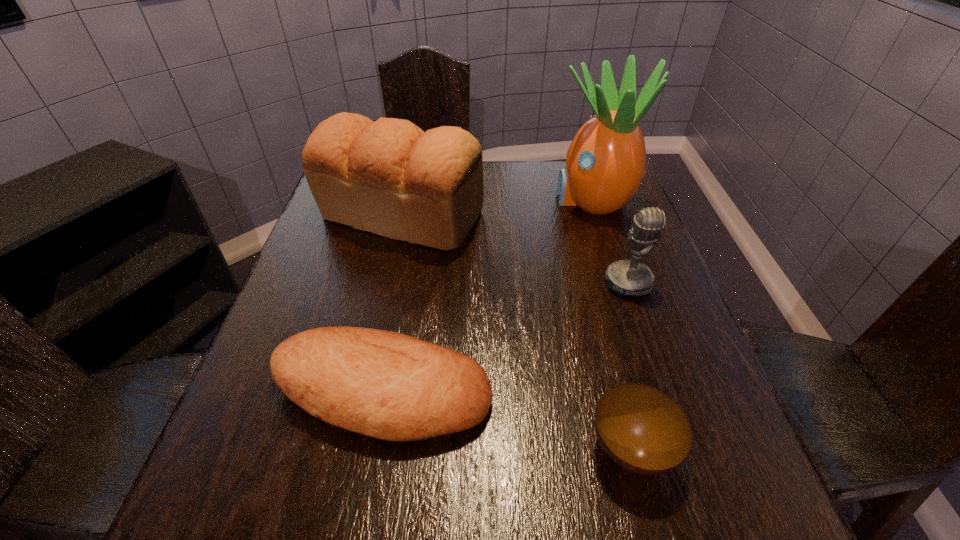
The width and height of the screenshot is (960, 540). I want to click on free area in between the fourth tallest object and the third nearest object, so click(505, 338).

At what (x,y) coordinates should I click in order to perform the action: click on blank region between the tallest object and the shortest object. Please return your answer as a coordinate pair (x, y). The image size is (960, 540). Looking at the image, I should click on (612, 323).

The height and width of the screenshot is (540, 960). I want to click on free space between the tallest object and the nearer bread, so click(x=487, y=295).

Where is `vacant area that lies between the taller bread and the tallest object`? vacant area that lies between the taller bread and the tallest object is located at coordinates (496, 207).

Where is `vacant space that is in between the pineapple and the fourth shortest object`? vacant space that is in between the pineapple and the fourth shortest object is located at coordinates (496, 207).

I want to click on unoccupied position between the pineapple and the shorter bread, so click(x=487, y=295).

Find the location of a particular element. free space between the bowl and the tallest object is located at coordinates (612, 323).

Locate an element on the screen. Image resolution: width=960 pixels, height=540 pixels. unoccupied position between the fourth tallest object and the farther bread is located at coordinates (392, 304).

Select which object appears as the second closest to the farther bread. Please provide its 2D coordinates. Your answer should be formatted as a tuple, i.e. [(x, y)], where the tuple contains the x and y coordinates of a point satisfying the conditions above.

[(387, 385)]

I want to click on object that can be found as the third closest to the fourth shortest object, so click(x=624, y=277).